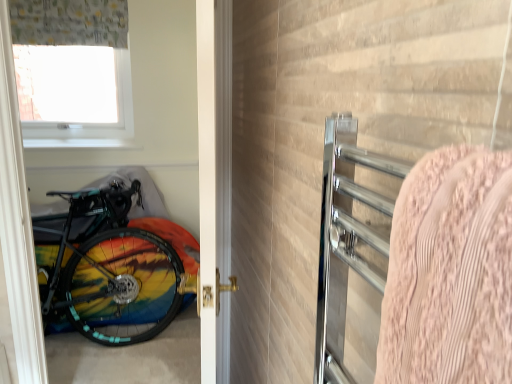
The width and height of the screenshot is (512, 384). Identify the location of blank area beneath patterned fabric curtain at upper left (from a real-world perspective). tap(79, 142).